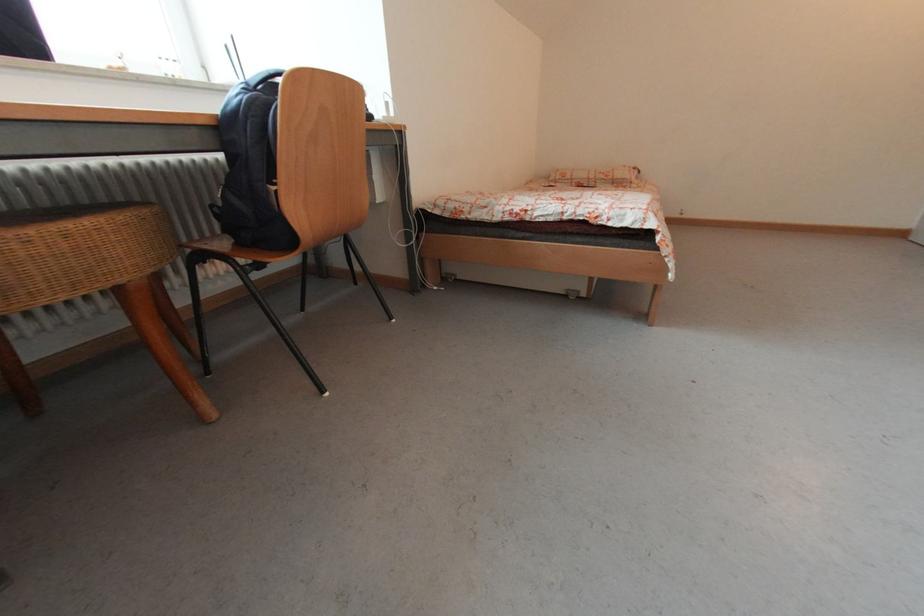
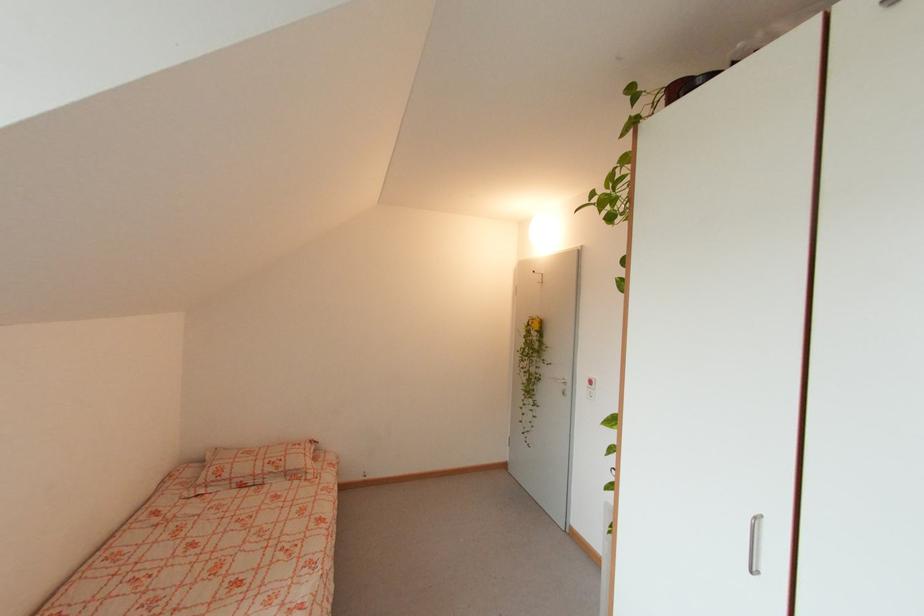
In the second image, find the point that corresponds to point 565,180 in the first image.

(219, 484)